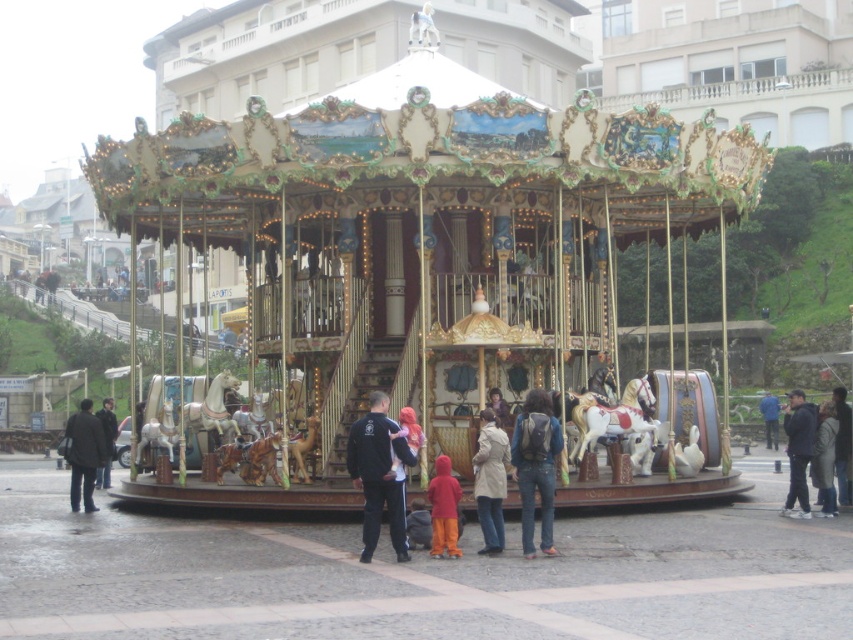
Question: Which is nearer to the black leather jacket at center?

Choices:
 (A) gold/ornate carousel at center
 (B) blue fabric jacket at center
 (C) dark blue jacket at center

Answer: (A)

Question: Is dark gray coat at lower left bigger than red velvet coat at center?

Choices:
 (A) no
 (B) yes

Answer: (B)

Question: Which object appears farthest from the camera in this image?

Choices:
 (A) denim backpack at center
 (B) dark blue fabric jacket at center
 (C) light beige coat at center
 (D) blue fabric jacket at center

Answer: (D)

Question: Is blue fabric jacket at center thinner than matte purple coat at center?

Choices:
 (A) yes
 (B) no

Answer: (B)

Question: Is gold/ornate carousel at center to the left of denim backpack at center from the viewer's perspective?

Choices:
 (A) yes
 (B) no

Answer: (A)

Question: Which of the following is the farthest from the observer?

Choices:
 (A) (71, 477)
 (B) (370, 465)
 (C) (105, 458)

Answer: (C)